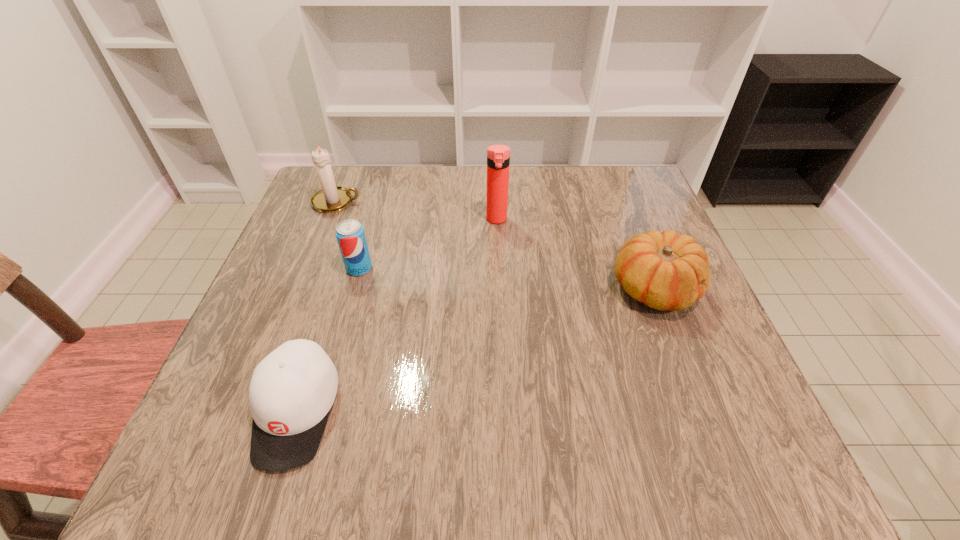
Locate an element on the screen. The width and height of the screenshot is (960, 540). the tallest object is located at coordinates (498, 156).

Locate an element on the screen. The height and width of the screenshot is (540, 960). thermos bottle is located at coordinates (498, 156).

At what (x,y) coordinates should I click in order to perform the action: click on the second tallest object. Please return your answer as a coordinate pair (x, y). Looking at the image, I should click on (331, 198).

Identify the location of soda can. (350, 235).

Find the location of `the rightmost object`. the rightmost object is located at coordinates (666, 271).

Where is `baseball cap`? The height and width of the screenshot is (540, 960). baseball cap is located at coordinates point(292,390).

You are a GUI agent. You are given a task and a screenshot of the screen. Output one action in this format:
    pyautogui.click(x=<x>, y=<y>)
    Task: Click on the free point located on the right of the second object from right to left
    The width and height of the screenshot is (960, 540).
    Given the screenshot: What is the action you would take?
    pyautogui.click(x=607, y=219)

Locate an element on the screen. The width and height of the screenshot is (960, 540). free space located on the handle side of the fourth shortest object is located at coordinates (406, 202).

Locate an element on the screen. vacant space located on the front of the soda can is located at coordinates (310, 443).

Where is `free spot located 0.190m on the back of the gourd`? free spot located 0.190m on the back of the gourd is located at coordinates (624, 210).